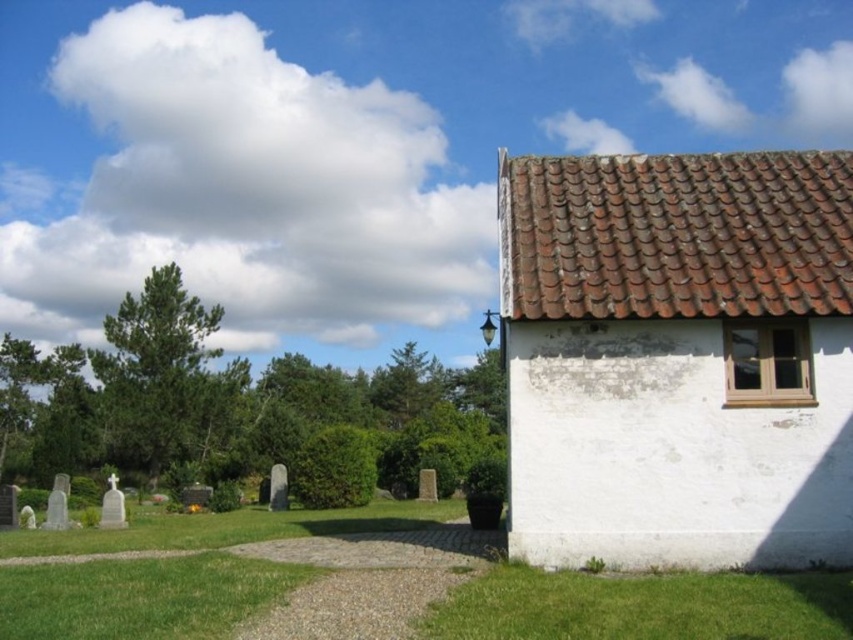
Is green grass at lower right smaller than green grass at lower left?

No, green grass at lower right is not smaller than green grass at lower left.

Which is in front, point (677, 625) or point (242, 584)?

Point (677, 625) is more forward.

Where is `green grass at lower right`? The image size is (853, 640). green grass at lower right is located at coordinates (643, 605).